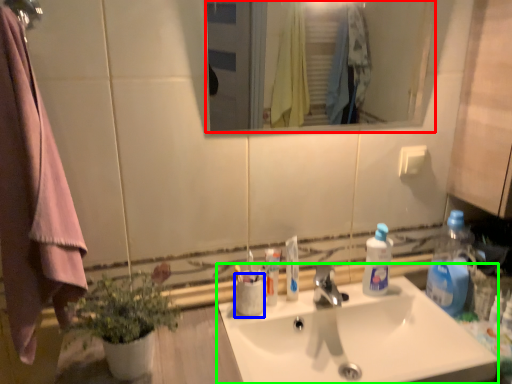
Question: Estimate the real-world distances between objects in this image. Which object is farther from mirror (highlighted by a red box), coffee cup (highlighted by a blue box) or sink (highlighted by a green box)?

Choices:
 (A) coffee cup
 (B) sink

Answer: (A)